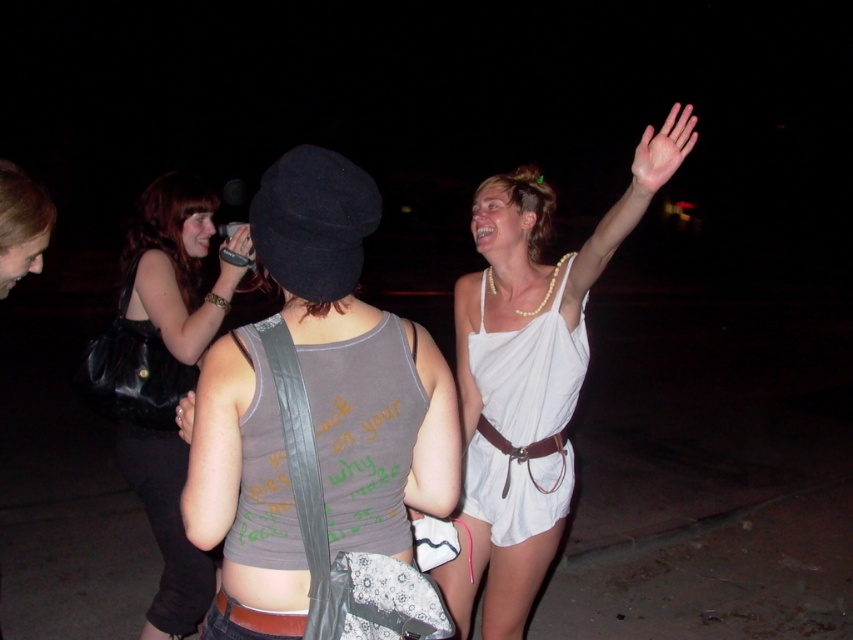
Between pale skin palm at upper right and matte white toga at upper right, which one is positioned lower?

pale skin palm at upper right

At what (x,y) coordinates should I click in order to perform the action: click on pale skin palm at upper right. Please return your answer as a coordinate pair (x, y). This screenshot has height=640, width=853. Looking at the image, I should click on (660, 150).

At what (x,y) coordinates should I click in order to perform the action: click on pale skin palm at upper right. Please return your answer as a coordinate pair (x, y). The width and height of the screenshot is (853, 640). Looking at the image, I should click on (660, 150).

Does matte black phone at center appear on the left side of matte black handbag at lower left?

Yes, matte black phone at center is to the left of matte black handbag at lower left.

Does matte black phone at center have a larger size compared to matte black handbag at lower left?

Indeed, matte black phone at center has a larger size compared to matte black handbag at lower left.

Is point (227, 225) behind point (178, 419)?

Yes, point (227, 225) is behind point (178, 419).

You are a GUI agent. You are given a task and a screenshot of the screen. Output one action in this format:
    pyautogui.click(x=<x>, y=<y>)
    Task: Click on the matte black phone at center
    
    Given the screenshot: What is the action you would take?
    pyautogui.click(x=238, y=253)

Is pale skin palm at upper right wider than matte black handbag at lower left?

Yes.

Between pale skin palm at upper right and matte black handbag at lower left, which one appears on the left side from the viewer's perspective?

Positioned to the left is matte black handbag at lower left.

What are the coordinates of `pale skin palm at upper right` in the screenshot? It's located at click(660, 150).